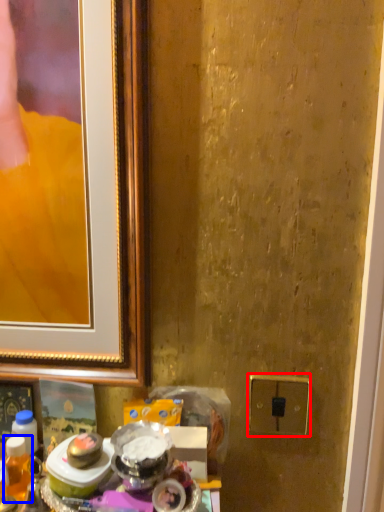
Question: Which object is closer to the camera taking this photo, electric outlet (highlighted by a red box) or beverage (highlighted by a blue box)?

Choices:
 (A) electric outlet
 (B) beverage

Answer: (B)